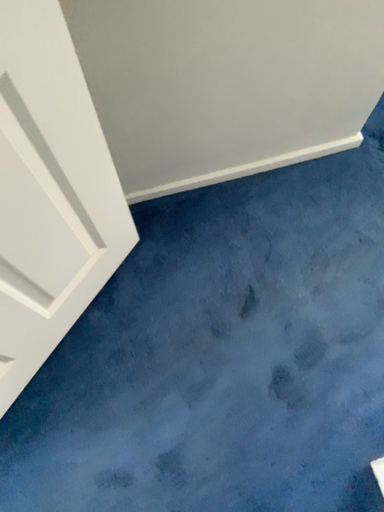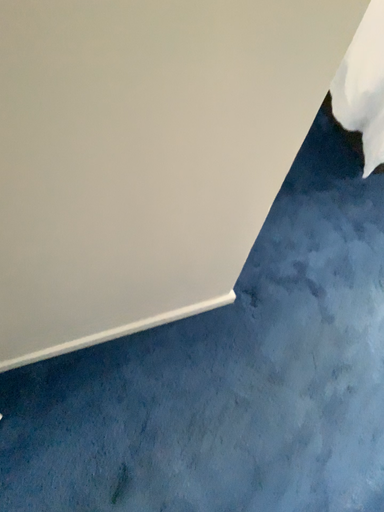
Question: Which way did the camera rotate in the video?

Choices:
 (A) rotated downward
 (B) rotated upward

Answer: (B)